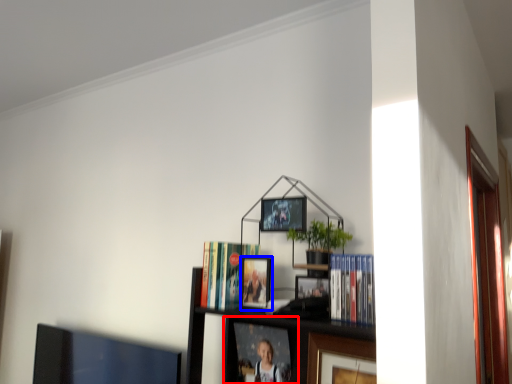
Question: Which object appears farthest to the camera in this image, picture frame (highlighted by a red box) or picture frame (highlighted by a blue box)?

Choices:
 (A) picture frame
 (B) picture frame

Answer: (A)